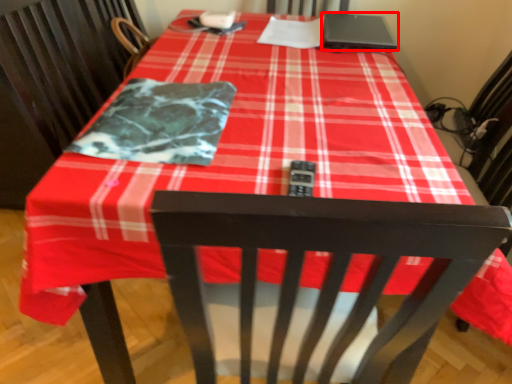
Question: From the image's perspective, where is laptop (annotated by the red box) located relative to blanket?

Choices:
 (A) below
 (B) above

Answer: (B)